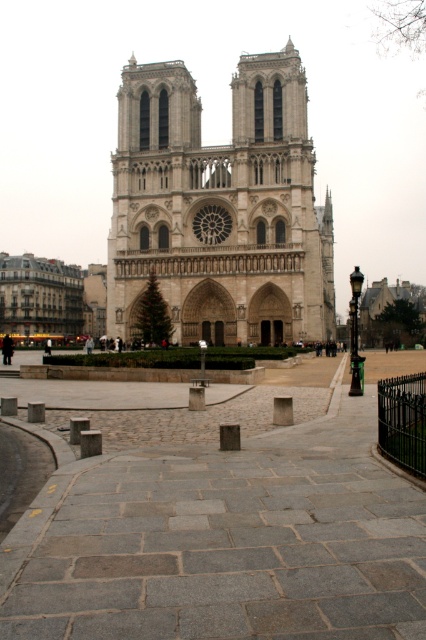
Question: Does gray stone plaza at center appear under stone gothic cathedral at center?

Choices:
 (A) no
 (B) yes

Answer: (B)

Question: Is gray stone plaza at center wider than stone gothic cathedral at center?

Choices:
 (A) yes
 (B) no

Answer: (B)

Question: Which point is farther to the camera?

Choices:
 (A) (103, 582)
 (B) (155, 129)

Answer: (B)

Question: Which point is farther to the camera?

Choices:
 (A) (94, 461)
 (B) (319, 324)

Answer: (B)

Question: Among these points, which one is nearest to the camera?

Choices:
 (A) (331, 230)
 (B) (339, 492)

Answer: (B)

Question: Does gray stone plaza at center appear over stone gothic cathedral at center?

Choices:
 (A) no
 (B) yes

Answer: (A)